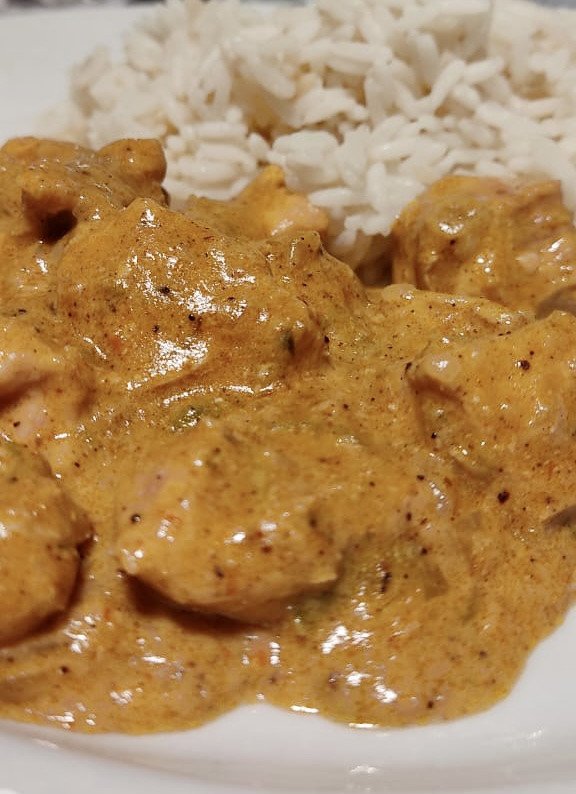
Locate an element on the screen. The image size is (576, 794). light gray plate is located at coordinates (280, 754), (554, 702).